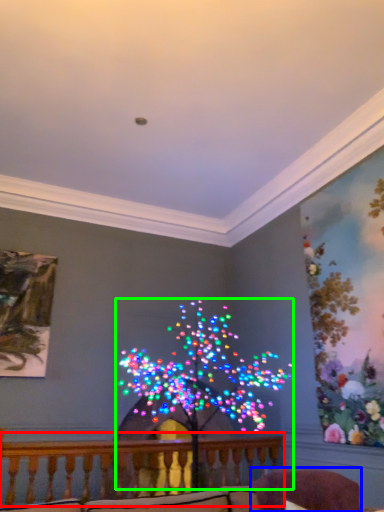
Question: Considering the real-world distances, which object is farthest from balcony (highlighted by a red box)? swivel chair (highlighted by a blue box) or christmas decoration (highlighted by a green box)?

Choices:
 (A) swivel chair
 (B) christmas decoration

Answer: (A)